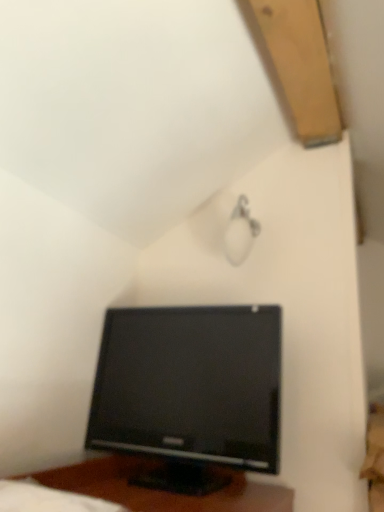
Identify the location of black glossy monitor at lower center. (189, 392).

This screenshot has height=512, width=384. Describe the element at coordinates (189, 392) in the screenshot. I see `black glossy monitor at lower center` at that location.

This screenshot has width=384, height=512. Find the location of `black glossy monitor at lower center`. black glossy monitor at lower center is located at coordinates (189, 392).